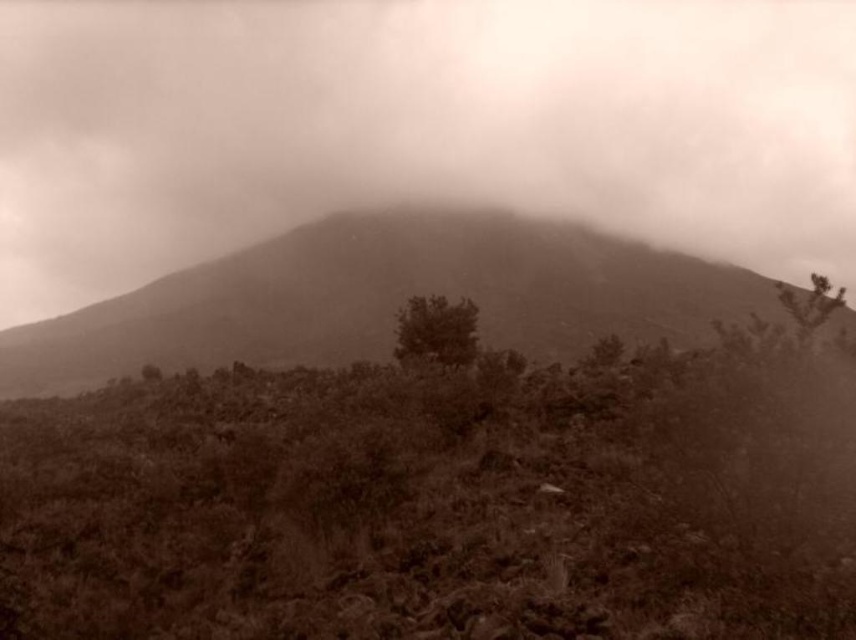
You are a GUI agent. You are given a task and a screenshot of the screen. Output one action in this format:
    pyautogui.click(x=<x>, y=<y>)
    Task: Click on the foggy mist at center
    
    Given the screenshot: What is the action you would take?
    pyautogui.click(x=415, y=125)

Who is taller, foggy mist at center or green leafy bush at center?

foggy mist at center is taller.

The height and width of the screenshot is (640, 856). I want to click on foggy mist at center, so click(415, 125).

Where is `foggy mist at center`? foggy mist at center is located at coordinates (415, 125).

Is brown textured shrubbery at center closer to camera compared to foggy mist at center?

Yes, brown textured shrubbery at center is closer to the viewer.

Is brown textured shrubbery at center above foggy mist at center?

No.

Is point (306, 448) positioned after point (364, 152)?

No, (306, 448) is in front of (364, 152).

Identify the location of brown textured shrubbery at center. The image size is (856, 640). (444, 499).

Which is below, sepia textured mountain at center or green leafy bush at center?

green leafy bush at center is lower down.

Between point (531, 317) and point (467, 300), which one is positioned behind?

Point (531, 317)

What do you see at coordinates (385, 298) in the screenshot? This screenshot has height=640, width=856. I see `sepia textured mountain at center` at bounding box center [385, 298].

Find the location of a particular element. sepia textured mountain at center is located at coordinates (385, 298).